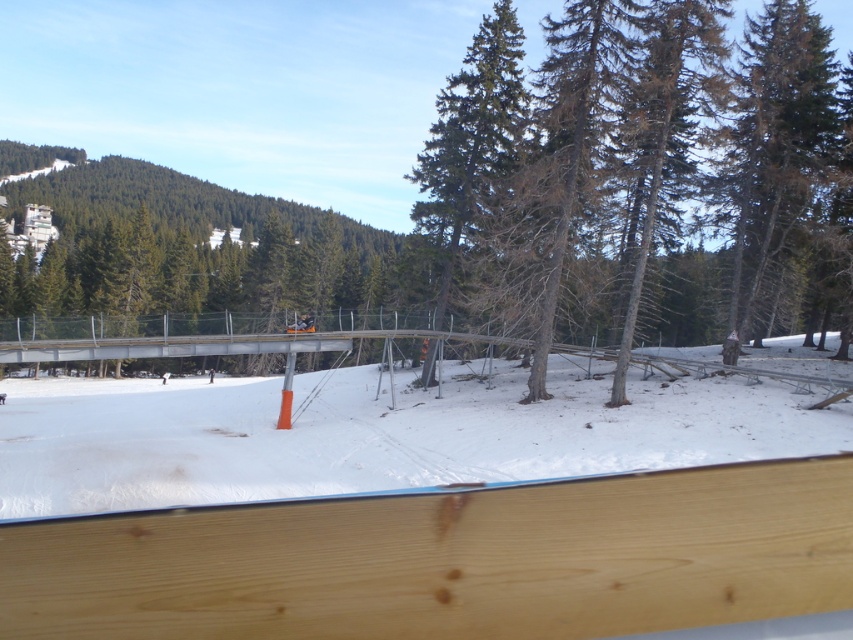
Question: Where is brown/dried wood at center located in relation to green coniferous tree at center in the image?

Choices:
 (A) left
 (B) right

Answer: (B)

Question: Estimate the real-world distances between objects in this image. Which object is closer to the brown wood tree at right?

Choices:
 (A) white snow at center
 (B) green coniferous tree at center

Answer: (A)

Question: Which point appears closest to the camera in this image?

Choices:
 (A) (437, 129)
 (B) (727, 132)
 (C) (811, 112)
 (D) (821, 392)

Answer: (D)

Question: Is brown/dried wood at center wider than green coniferous tree at center?

Choices:
 (A) no
 (B) yes

Answer: (B)

Question: Which of the following is the farthest from the observer?

Choices:
 (A) (109, 419)
 (B) (793, 164)
 (C) (490, 60)

Answer: (A)

Question: Observing the image, what is the correct spatial positioning of brown wood tree at right in reference to green coniferous tree at center?

Choices:
 (A) above
 (B) below

Answer: (B)